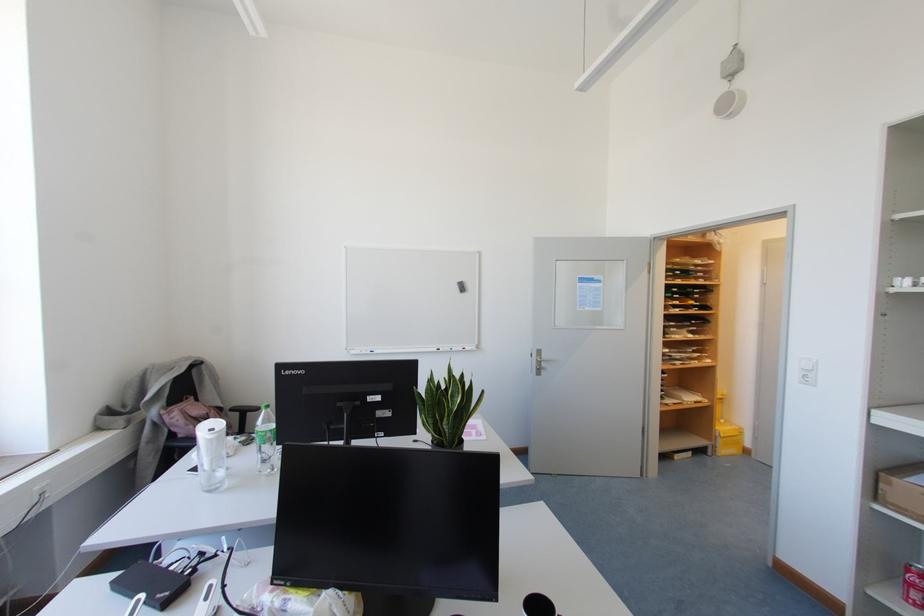
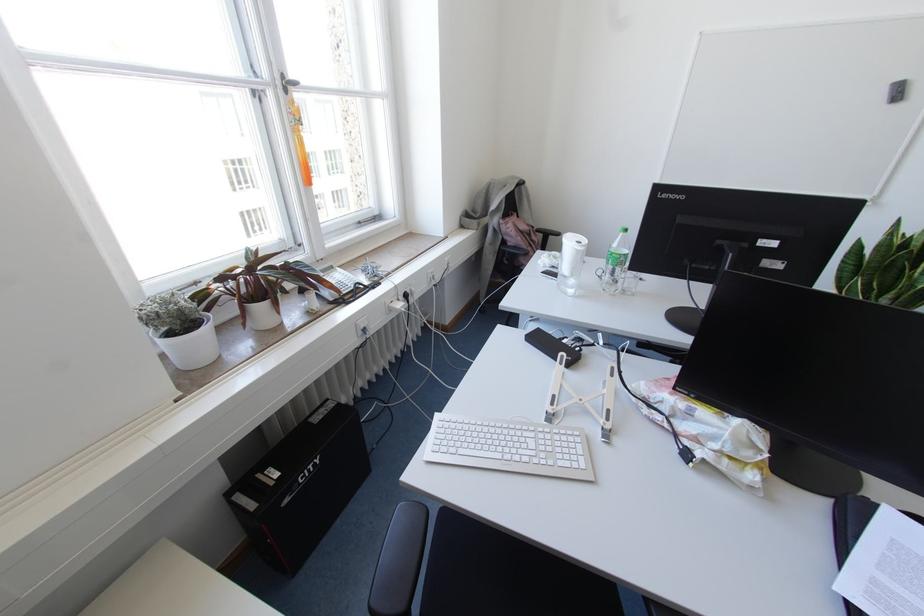
In the scene shown: First-person continuous shooting, in which direction is the camera rotating?

The camera rotated toward left-down.